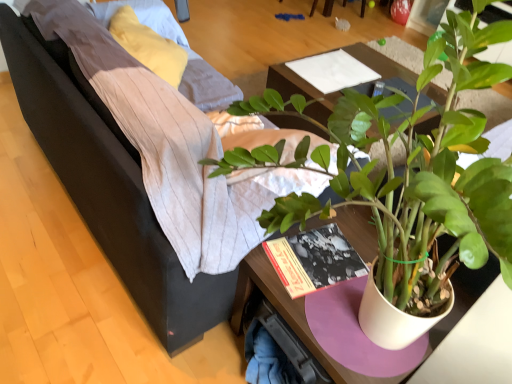
Question: In terms of size, does green matte plant at center appear bigger or smaller than dark gray fabric couch at center?

Choices:
 (A) small
 (B) big

Answer: (A)

Question: Considering the positions of green matte plant at center and dark gray fabric couch at center in the image, is green matte plant at center taller or shorter than dark gray fabric couch at center?

Choices:
 (A) short
 (B) tall

Answer: (B)

Question: Based on their relative distances, which object is farther from the green matte plant at center?

Choices:
 (A) wooden table at center
 (B) white paper at center
 (C) dark gray fabric couch at center

Answer: (B)

Question: Which object is the closest to the white paper at center?

Choices:
 (A) dark gray fabric couch at center
 (B) green matte plant at center
 (C) wooden table at center

Answer: (C)